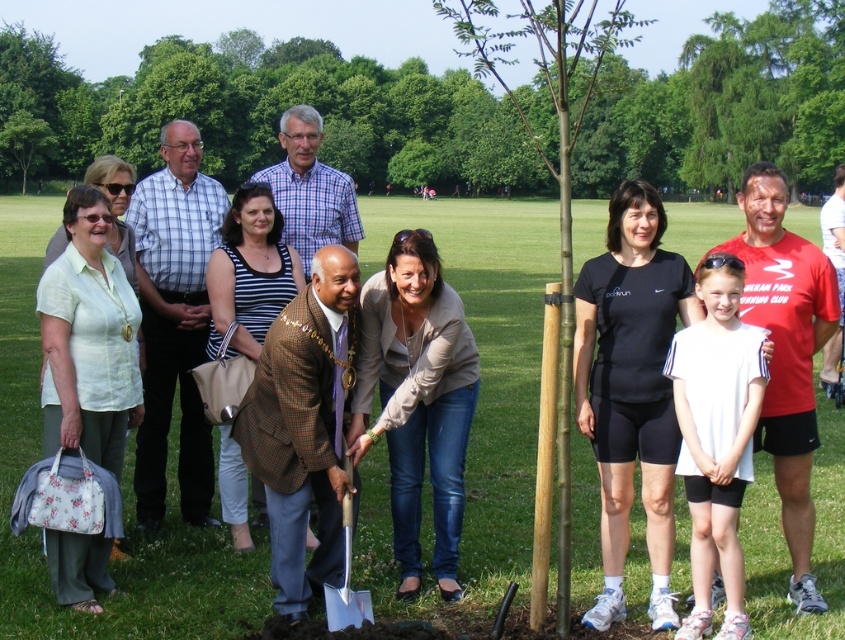
Consider the image. Does white cotton shirt at center have a greater width compared to silver metallic shovel at center?

Yes, white cotton shirt at center is wider than silver metallic shovel at center.

Who is lower down, white cotton shirt at center or silver metallic shovel at center?

silver metallic shovel at center is below.

Who is more distant from viewer, (669, 352) or (363, 611)?

The point (363, 611) is behind.

At what (x,y) coordinates should I click in order to perform the action: click on white cotton shirt at center. Please return your answer as a coordinate pair (x, y). This screenshot has width=845, height=640. Looking at the image, I should click on (717, 436).

Does green bamboo at center have a smaller size compared to green leafy tree at upper left?

No, green bamboo at center is not smaller than green leafy tree at upper left.

Who is positioned more to the left, green bamboo at center or green leafy tree at upper left?

green leafy tree at upper left

Does point (1, 396) come farther from viewer compared to point (4, 145)?

No, it is in front of (4, 145).

The width and height of the screenshot is (845, 640). Find the location of `green bamboo at center`. green bamboo at center is located at coordinates (478, 394).

From the picture: Who is more forward, (x=842, y=522) or (x=724, y=278)?

Positioned in front is point (x=724, y=278).

Who is lower down, green bamboo at center or white cotton shirt at center?

Positioned lower is white cotton shirt at center.

Who is more distant from viewer, (19,317) or (756,381)?

Positioned behind is point (19,317).

Identify the location of green bamboo at center. (478, 394).